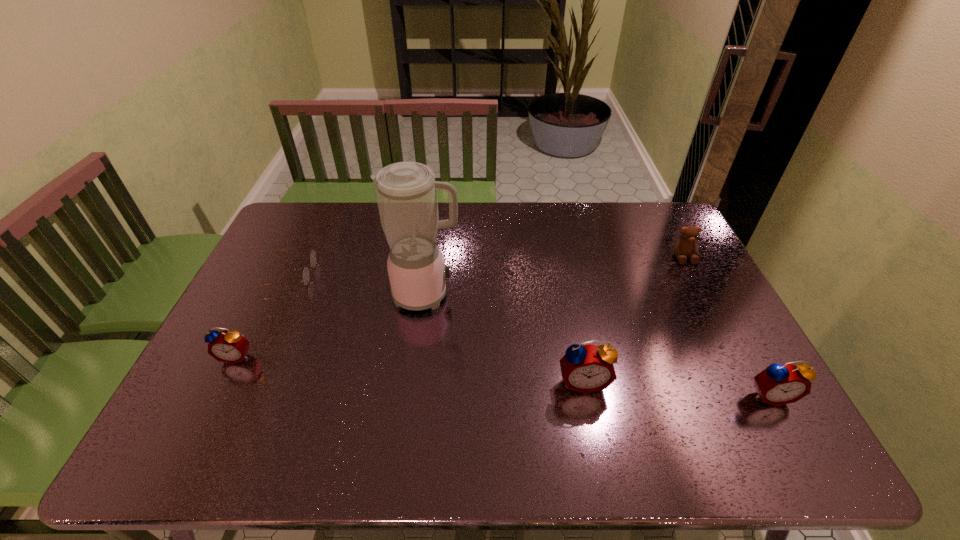
This screenshot has height=540, width=960. What are the coordinates of `free point that satisfies the following two spatial constraints: 1. on the face of the teddy bear; 2. on the base of the tallest object near the control knob` in the screenshot? It's located at (703, 294).